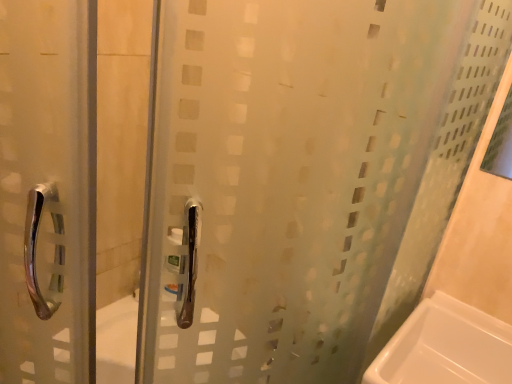
Describe the element at coordinates (445, 347) in the screenshot. Image resolution: width=512 pixels, height=384 pixels. I see `white glossy bath at lower right` at that location.

What is the approximate width of white glossy bath at lower right?

29.63 centimeters.

This screenshot has height=384, width=512. Find the location of `white glossy bath at lower right`. white glossy bath at lower right is located at coordinates (445, 347).

Where is `white glossy bath at lower right`? white glossy bath at lower right is located at coordinates (445, 347).